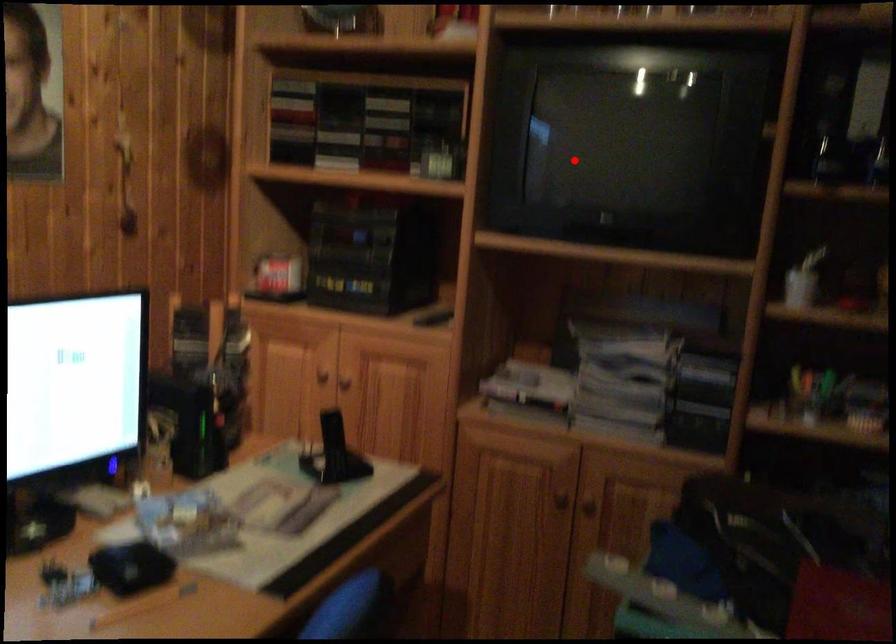
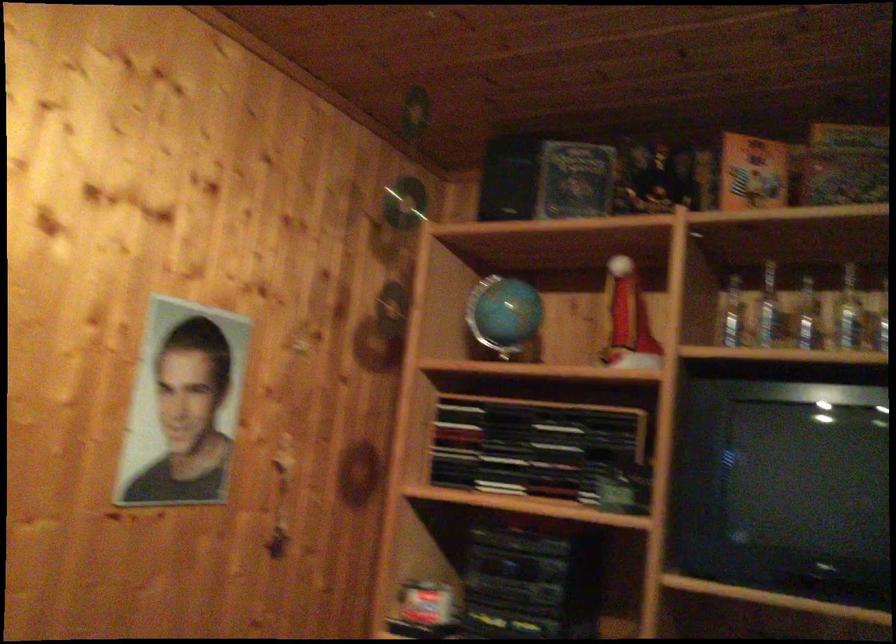
Where in the second image is the point corresponding to the highlighted location from the first image?

(785, 488)